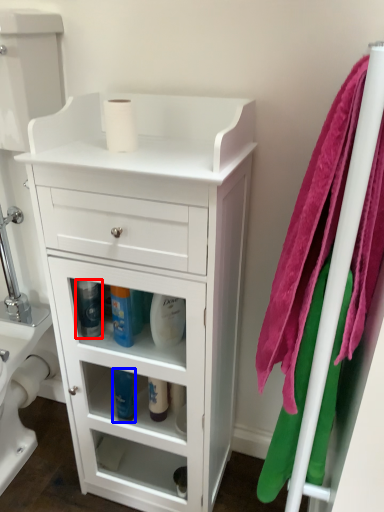
Question: Which object appears closest to the camera in this image, cleaning product (highlighted by a red box) or cleaning product (highlighted by a blue box)?

Choices:
 (A) cleaning product
 (B) cleaning product

Answer: (A)